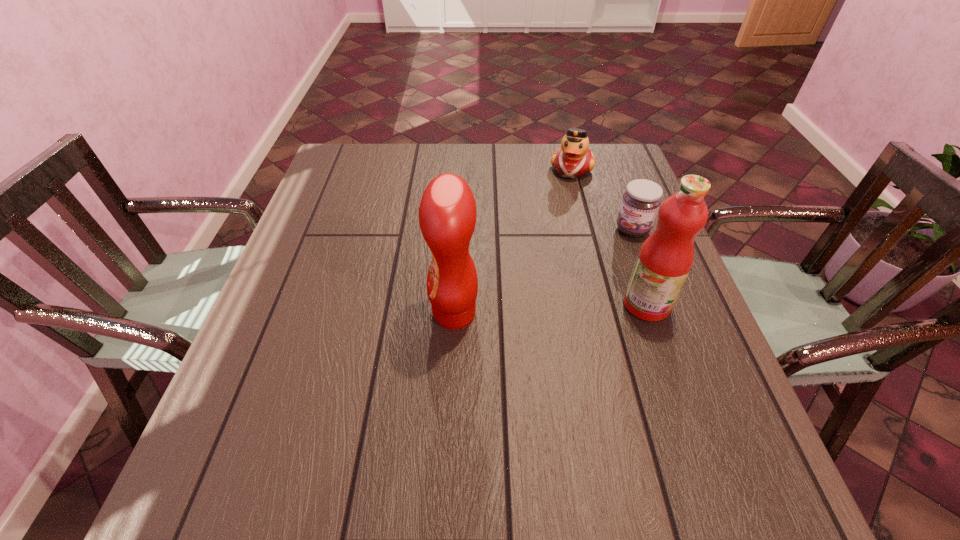
Locate an element on the screen. Image resolution: width=960 pixels, height=540 pixels. free spot at the right edge of the desktop is located at coordinates (699, 319).

The height and width of the screenshot is (540, 960). I want to click on free space at the far left corner, so click(x=371, y=151).

The height and width of the screenshot is (540, 960). What are the coordinates of `vacant space at the near left corner` in the screenshot? It's located at (255, 408).

Where is `vacant space at the near right corner`? vacant space at the near right corner is located at coordinates (701, 410).

Locate an element on the screen. This screenshot has height=540, width=960. empty space between the fruit juice and the duck is located at coordinates (610, 237).

Image resolution: width=960 pixels, height=540 pixels. In order to click on blank region between the condiment and the duck in this screenshot , I will do `click(513, 241)`.

Locate an element on the screen. The height and width of the screenshot is (540, 960). vacant space that's between the condiment and the fruit juice is located at coordinates pyautogui.click(x=550, y=309).

Find the location of a particular element. This screenshot has height=540, width=960. empty space that is in between the jam and the leftmost object is located at coordinates (543, 272).

This screenshot has width=960, height=540. I want to click on unoccupied position between the fruit juice and the farthest object, so click(610, 237).

Find the location of a particular element. free area in between the condiment and the farthest object is located at coordinates [x=513, y=241].